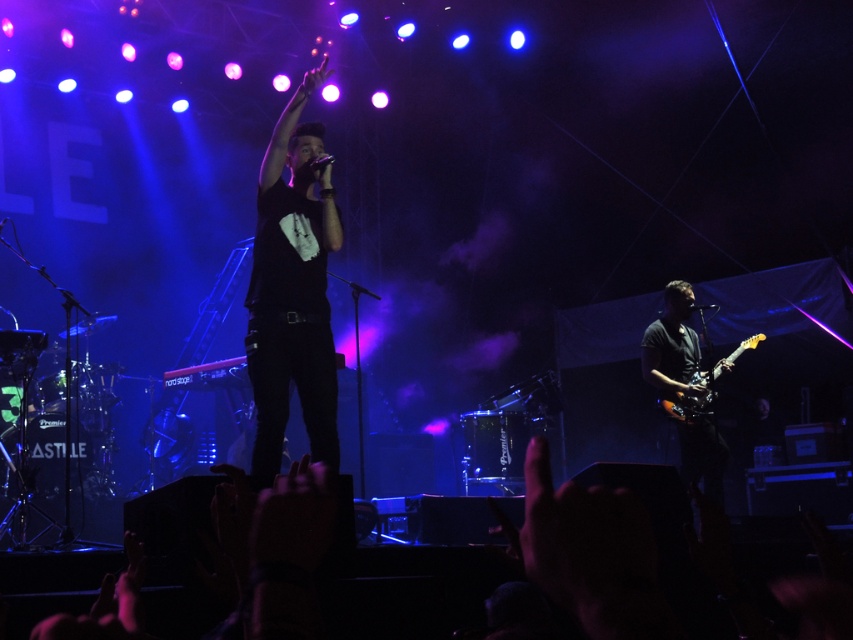
You are a photographer at the concert and want to capture a clear shot of both the black matte shirt at center and the shiny black guitar at right. Since the stage lighting is very bright, you need to adjust your camera settings. Considering the position of the objects, which object might be easier to focus on and why?

The black matte shirt at center is positioned over the shiny black guitar at right, so it is closer to the camera. Since it is closer, the black matte shirt at center would be easier to focus on as the camera can lock onto it more easily than the guitar behind it.

You are a photographer in the audience at the concert. You want to take a photo of the black matte shirt at center and the shiny black guitar at right. Can you clearly see both objects in the same photo without any obstruction?

The black matte shirt at center is in front of the shiny black guitar at right, so the black matte shirt at center may block part of the shiny black guitar at right in the photo.

You are a stagehand who needs to quickly retrieve a guitar from the right side of the stage. You see the shiny black guitar at right and the glossy wood electric guitar at right. Which one is closer to you?

The shiny black guitar at right is closer to you because it is in front of the glossy wood electric guitar at right.